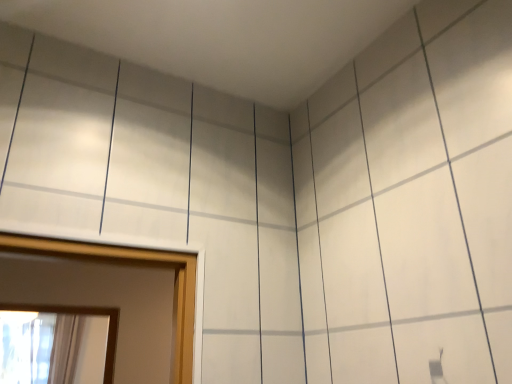
The image size is (512, 384). What do you see at coordinates (65, 348) in the screenshot? I see `white sheer fabric at lower left` at bounding box center [65, 348].

The height and width of the screenshot is (384, 512). I want to click on white sheer fabric at lower left, so click(x=65, y=348).

Locate an element on the screen. This screenshot has height=384, width=512. white sheer fabric at lower left is located at coordinates (65, 348).